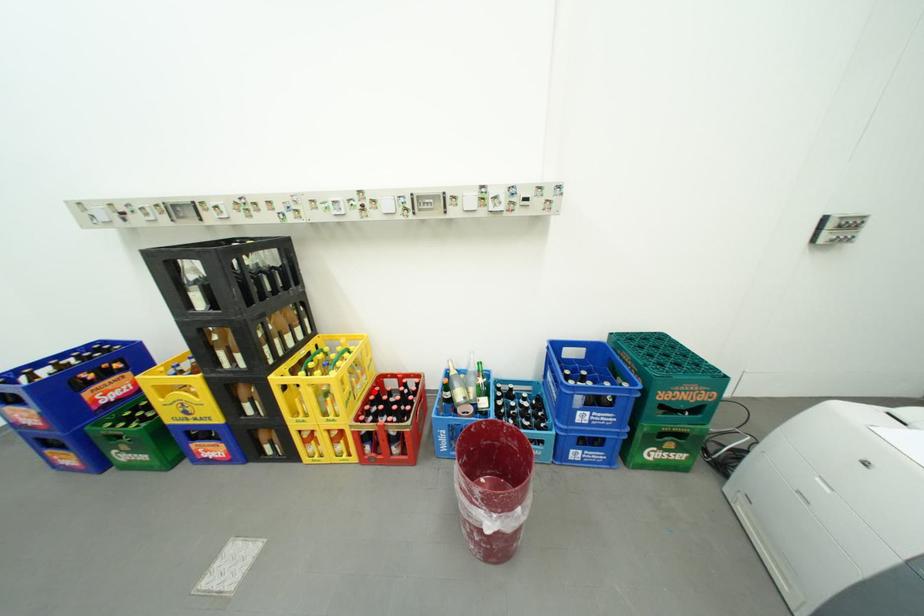
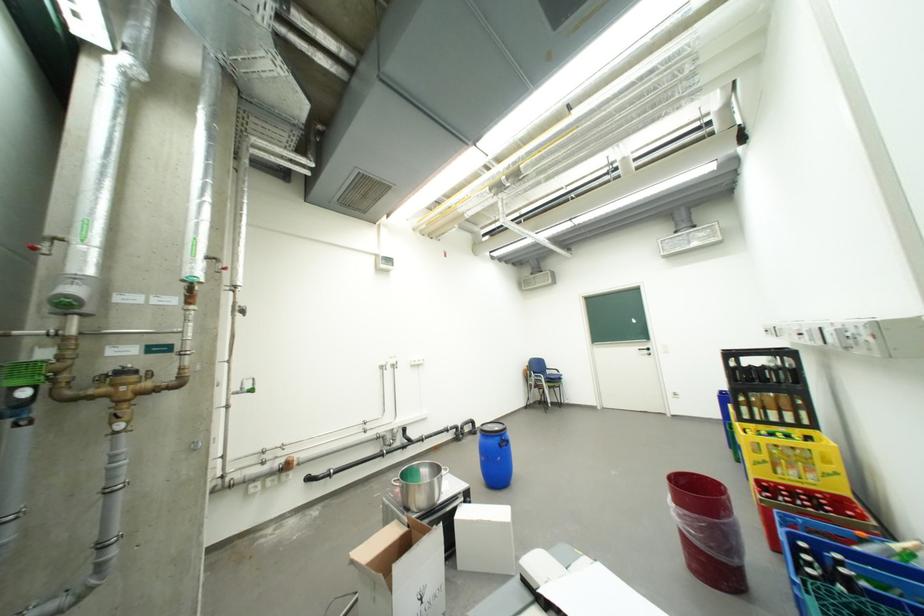
Question: I am providing you with two images of the same scene from different viewpoints. A red point is marked on the first image. Is the red point's position out of view in image 2?

Choices:
 (A) Yes
 (B) No

Answer: (B)